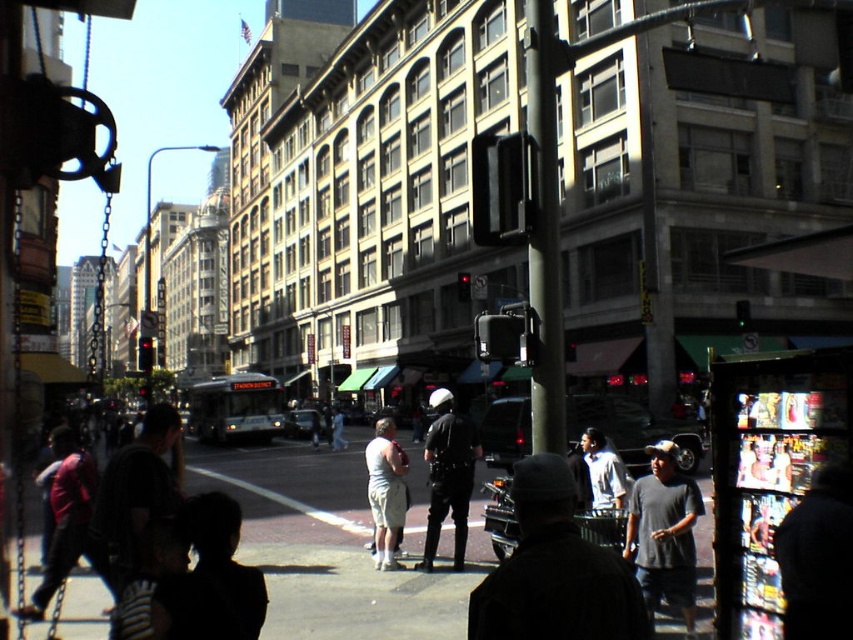
Can you confirm if gray cotton t-shirt at center-right is positioned to the left of red shirt at left?

Incorrect, gray cotton t-shirt at center-right is not on the left side of red shirt at left.

Does gray cotton t-shirt at center-right appear under red shirt at left?

No.

Which is behind, point (685, 506) or point (71, 540)?

The point (71, 540) is behind.

The width and height of the screenshot is (853, 640). I want to click on gray cotton t-shirt at center-right, so click(664, 534).

Can you confirm if dark blue jacket at lower right is positioned to the right of gray cotton t-shirt at center-right?

Correct, you'll find dark blue jacket at lower right to the right of gray cotton t-shirt at center-right.

Between point (849, 506) and point (653, 474), which one is positioned behind?

The point (653, 474) is behind.

Between point (778, 557) and point (680, 531), which one is positioned behind?

The point (680, 531) is behind.

Identify the location of dark blue jacket at lower right. (817, 557).

Can you confirm if dark hair at center is positioned to the right of light gray shirt at center?

Incorrect, dark hair at center is not on the right side of light gray shirt at center.

Does point (247, 627) come closer to viewer compared to point (601, 435)?

Yes, point (247, 627) is closer to viewer.

Which is in front, point (242, 602) or point (595, 429)?

Positioned in front is point (242, 602).

At what (x,y) coordinates should I click in order to perform the action: click on dark hair at center. Please return your answer as a coordinate pair (x, y). This screenshot has height=640, width=853. Looking at the image, I should click on (212, 579).